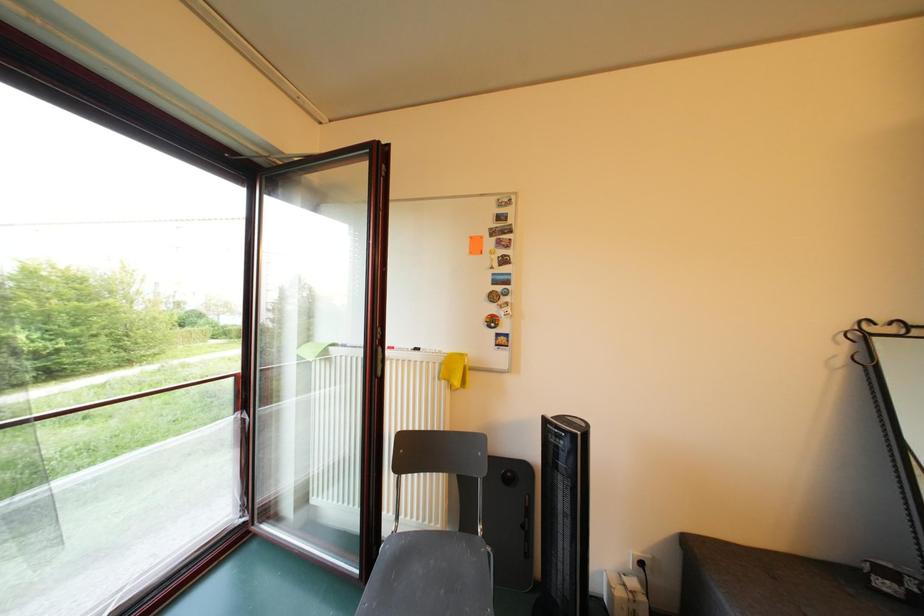
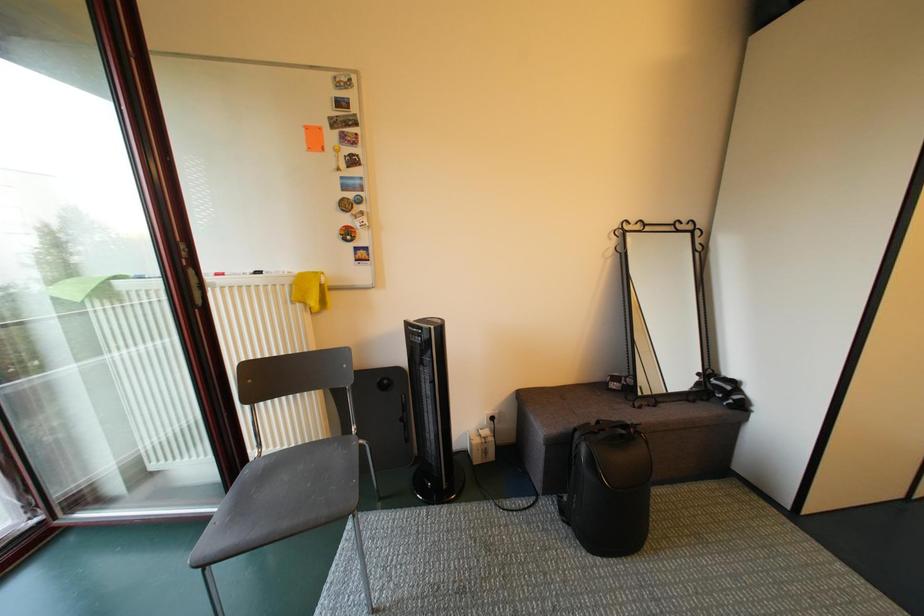
Question: Which direction would the cameraman need to move to produce the second image? Reply with the corresponding letter.

Choices:
 (A) Left
 (B) Right
 (C) Forward
 (D) Backward

Answer: (B)